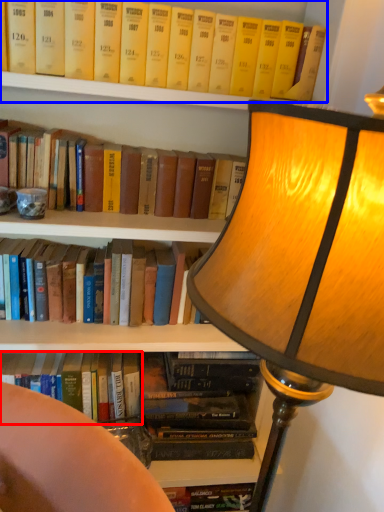
Question: Which of the following is the closest to the observer, book (highlighted by a red box) or book (highlighted by a blue box)?

Choices:
 (A) book
 (B) book

Answer: (B)